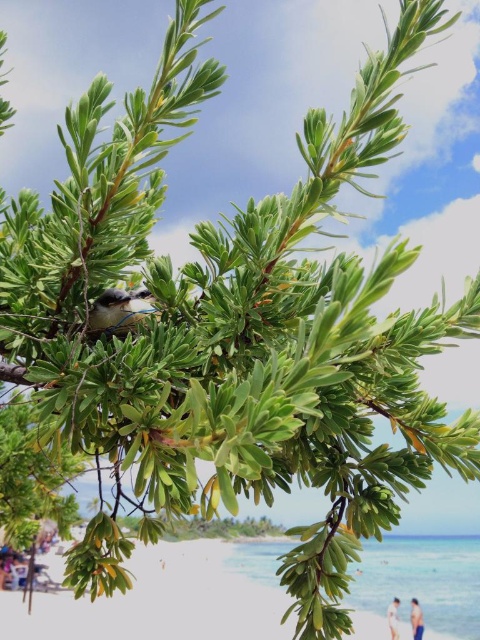
You are standing on the tropical beach and notice the soft brown feathers at center. Where exactly are these feathers positioned relative to the lush green foliage in the foreground?

The soft brown feathers at center are located at point 0.487 along the horizontal axis and 0.240 along the vertical axis, which places them slightly to the right and above the lush green foliage in the foreground.

You are a photographer standing on the beach and want to capture a photo of the light blue skin at lower right and the white cotton shirt at lower right in the same frame. The camera you are using has a minimum focus distance of 4 inches. Will both subjects be in focus if they are positioned at their current distance apart?

The distance between the light blue skin at lower right and the white cotton shirt at lower right is 4.62 inches, which is greater than the camera minimum focus distance of 4 inches. Therefore, both subjects will be in focus in the photo.

You are standing on the white sand beach at lower left and want to place a small flag on the soft brown feathers at center. Since the flag is 1 meter tall, will it be visible from above when placed there?

The white sand beach at lower left is taller than the soft brown feathers at center. Since the flag is 1 meter tall, it will be visible from above when placed on the soft brown feathers at center because the feathers are shorter than the beach area where you are standing.